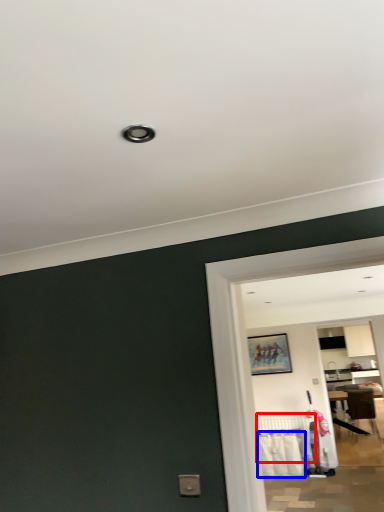
Question: Which object is further to the camera taking this photo, radiator (highlighted by a red box) or laundry (highlighted by a blue box)?

Choices:
 (A) radiator
 (B) laundry

Answer: (A)